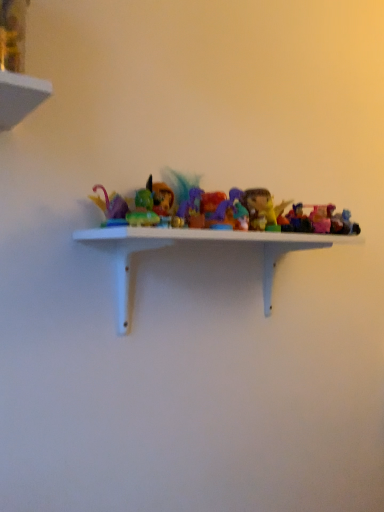
Question: Is matte green toy at center, positioned as the 6th toy in right-to-left order, wider than translucent plastic toy at center, marked as the 3th toy in a right-to-left arrangement?

Choices:
 (A) yes
 (B) no

Answer: (B)

Question: From the image's perspective, is matte green toy at center, positioned as the 6th toy in right-to-left order, on translucent plastic toy at center, which appears as the fourth toy when viewed from the left?

Choices:
 (A) no
 (B) yes

Answer: (A)

Question: Can you confirm if matte green toy at center, positioned as the 6th toy in right-to-left order, is positioned to the right of translucent plastic toy at center, which appears as the fourth toy when viewed from the left?

Choices:
 (A) yes
 (B) no

Answer: (B)

Question: Would you say matte green toy at center, which is the 1th toy from left to right, is a long distance from translucent plastic toy at center, marked as the 3th toy in a right-to-left arrangement?

Choices:
 (A) yes
 (B) no

Answer: (B)

Question: Does matte green toy at center, positioned as the 6th toy in right-to-left order, appear on the left side of translucent plastic toy at center, marked as the 3th toy in a right-to-left arrangement?

Choices:
 (A) no
 (B) yes

Answer: (B)

Question: Considering the positions of translucent plastic figurine at center, the 4th toy viewed from the right, and translucent plastic toy at center, which appears as the 2th toy when viewed from the right, in the image, is translucent plastic figurine at center, the 4th toy viewed from the right, taller or shorter than translucent plastic toy at center, which appears as the 2th toy when viewed from the right,?

Choices:
 (A) short
 (B) tall

Answer: (B)

Question: From the image's perspective, is translucent plastic figurine at center, the 3th toy when ordered from left to right, located above or below translucent plastic toy at center, which ranks as the 5th toy in left-to-right order?

Choices:
 (A) below
 (B) above

Answer: (B)

Question: In the image, is translucent plastic figurine at center, the 4th toy viewed from the right, on the left side or the right side of translucent plastic toy at center, which ranks as the 5th toy in left-to-right order?

Choices:
 (A) right
 (B) left

Answer: (B)

Question: From a real-world perspective, is translucent plastic figurine at center, the 3th toy when ordered from left to right, above or below translucent plastic toy at center, which ranks as the 5th toy in left-to-right order?

Choices:
 (A) below
 (B) above

Answer: (B)

Question: From the image's perspective, is white matte shelf at center positioned above or below translucent purple figurine at center, which is counted as the second toy, starting from the left?

Choices:
 (A) above
 (B) below

Answer: (B)

Question: Is point (125, 313) positioned closer to the camera than point (216, 220)?

Choices:
 (A) farther
 (B) closer

Answer: (A)

Question: From a real-world perspective, is white matte shelf at center physically located above or below translucent purple figurine at center, which is counted as the second toy, starting from the left?

Choices:
 (A) above
 (B) below

Answer: (B)

Question: Considering the positions of white matte shelf at center and translucent purple figurine at center, which is counted as the second toy, starting from the left, in the image, is white matte shelf at center bigger or smaller than translucent purple figurine at center, which is counted as the second toy, starting from the left,?

Choices:
 (A) big
 (B) small

Answer: (A)

Question: Which is correct: translucent plastic toy at center, marked as the 3th toy in a right-to-left arrangement, is inside white matte shelf at center, or outside of it?

Choices:
 (A) outside
 (B) inside

Answer: (A)

Question: In the image, is translucent plastic toy at center, which appears as the fourth toy when viewed from the left, positioned in front of or behind white matte shelf at center?

Choices:
 (A) behind
 (B) front

Answer: (A)